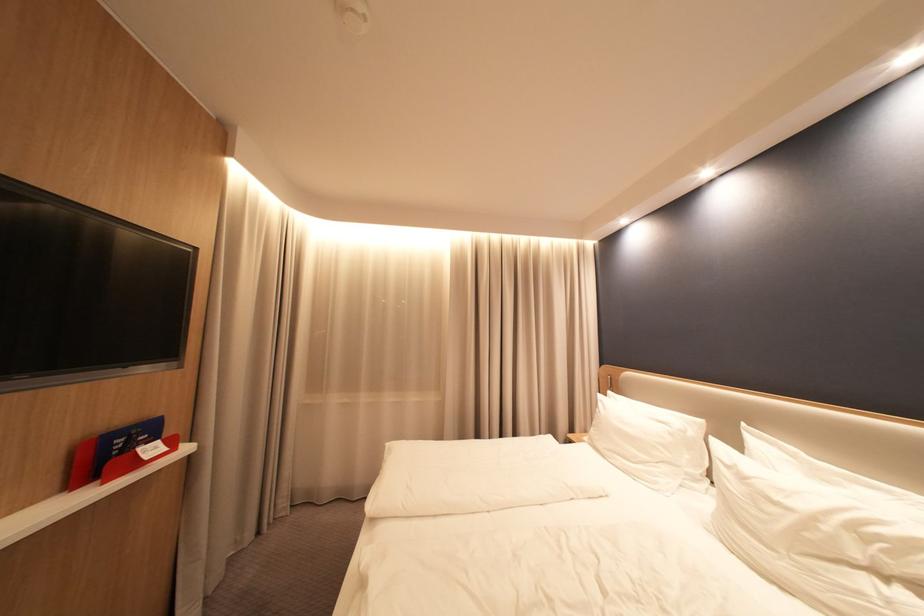
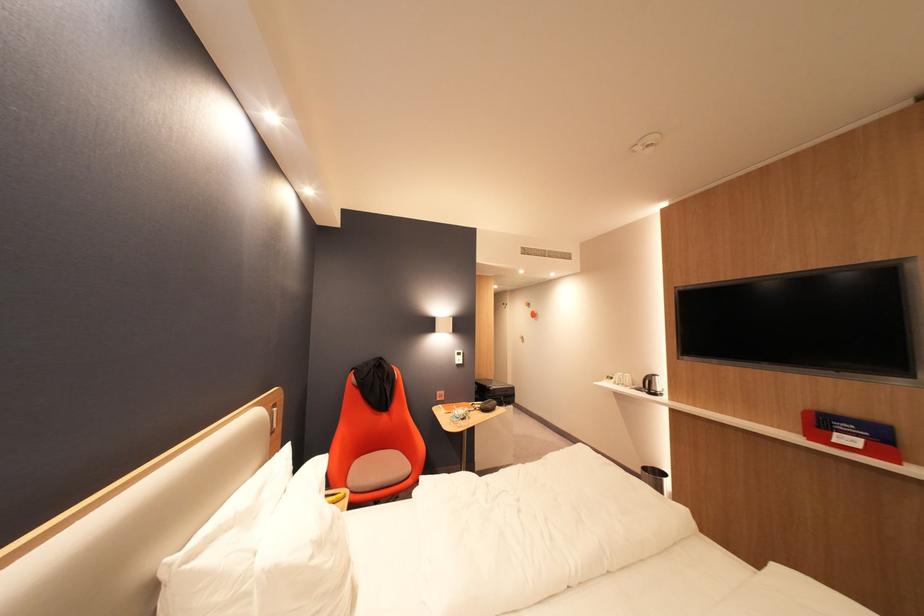
Where in the second image is the point corresponding to the point at 752,479 from the first image?

(330, 545)